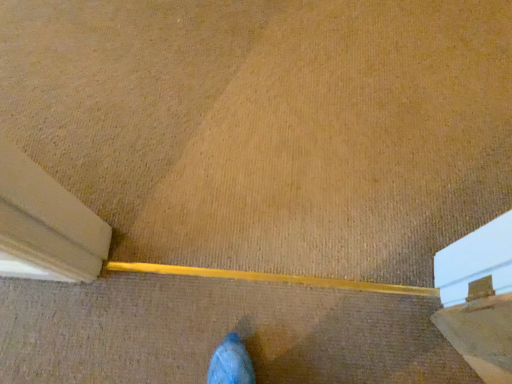
Question: Should I look upward or downward to see brown textured brush at center?

Choices:
 (A) up
 (B) down

Answer: (B)